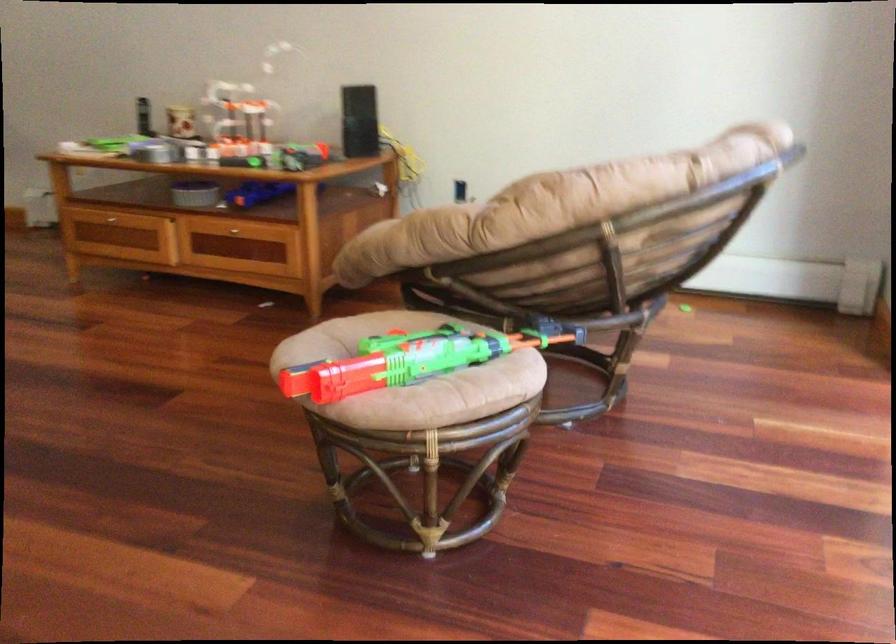
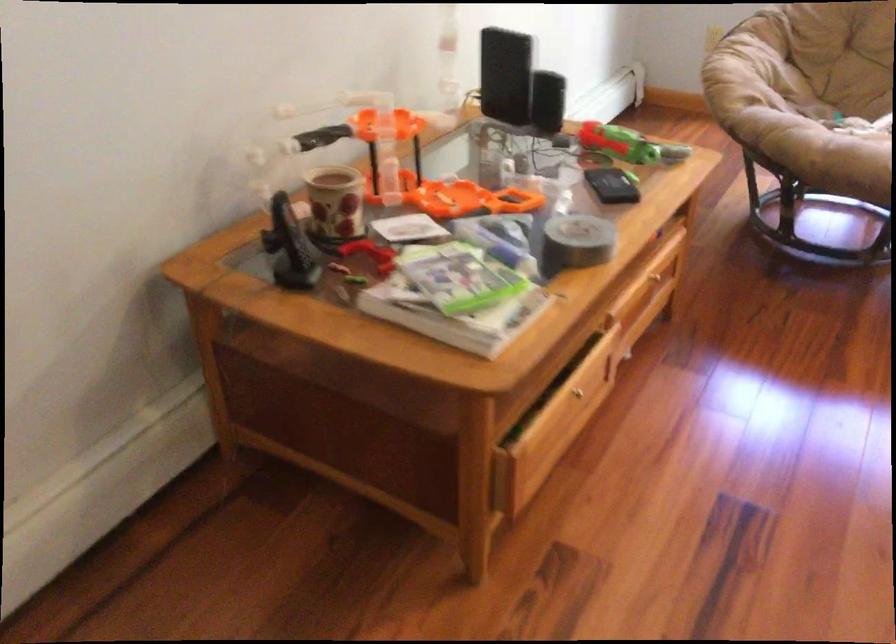
Find the pixel in the second image that matches (x=286, y=153) in the first image.

(627, 145)